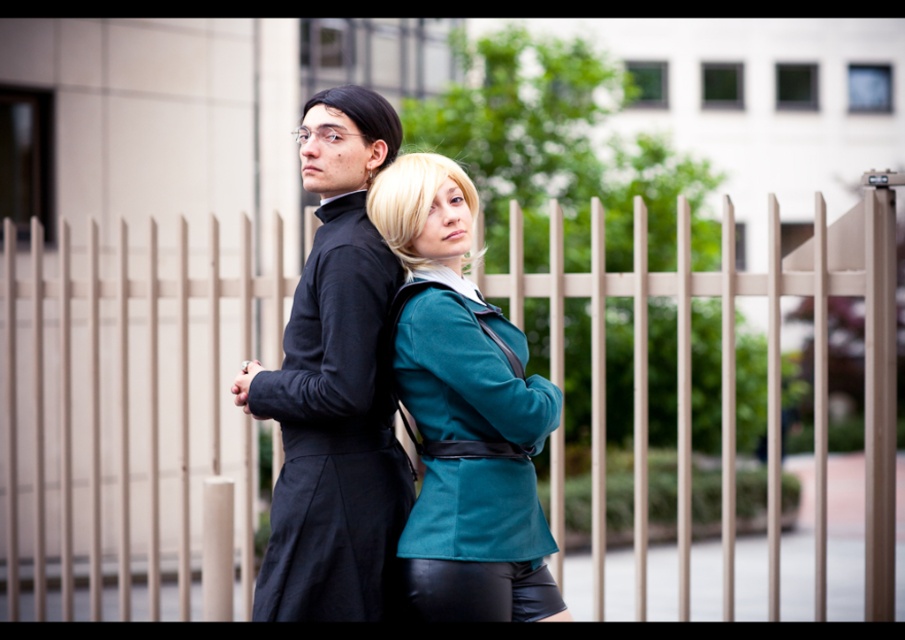
Which of these two, metallic silver fence at center or matte black suit at center, stands taller?

metallic silver fence at center is taller.

Which is more to the left, metallic silver fence at center or matte black suit at center?

Positioned to the left is metallic silver fence at center.

Does point (875, 616) come farther from viewer compared to point (303, 500)?

Yes, it is behind point (303, 500).

Image resolution: width=905 pixels, height=640 pixels. In order to click on metallic silver fence at center in this screenshot , I will do `click(732, 368)`.

What do you see at coordinates (334, 385) in the screenshot? This screenshot has height=640, width=905. I see `matte black suit at center` at bounding box center [334, 385].

Does matte black suit at center appear under teal fabric jacket at center?

Incorrect, matte black suit at center is not positioned below teal fabric jacket at center.

Find the location of a particular element. matte black suit at center is located at coordinates (334, 385).

Can you confirm if metallic silver fence at center is positioned to the left of teal fabric jacket at center?

Correct, you'll find metallic silver fence at center to the left of teal fabric jacket at center.

Which is in front, point (740, 276) or point (500, 609)?

Point (500, 609) is in front.

Image resolution: width=905 pixels, height=640 pixels. I want to click on metallic silver fence at center, so click(732, 368).

Where is `metallic silver fence at center`? The width and height of the screenshot is (905, 640). metallic silver fence at center is located at coordinates (732, 368).